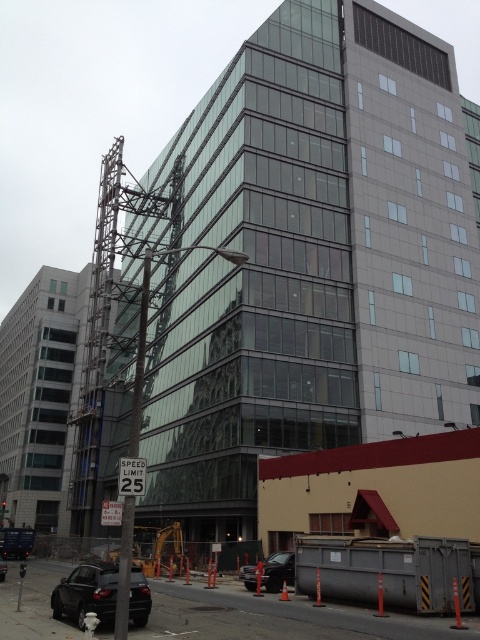
Question: Does gray concrete construction site at lower center appear on the left side of shiny black sedan at lower center?

Choices:
 (A) no
 (B) yes

Answer: (B)

Question: Which object appears farthest from the camera in this image?

Choices:
 (A) gray concrete construction site at lower center
 (B) shiny black sedan at lower center

Answer: (B)

Question: Does gray concrete construction site at lower center have a larger size compared to black matte car at lower left?

Choices:
 (A) yes
 (B) no

Answer: (A)

Question: Which object appears closest to the camera in this image?

Choices:
 (A) black matte car at lower left
 (B) gray concrete construction site at lower center

Answer: (A)

Question: From the image, what is the correct spatial relationship of gray concrete construction site at lower center in relation to shiny black sedan at lower center?

Choices:
 (A) below
 (B) above

Answer: (B)

Question: Which of the following is the closest to the observer?

Choices:
 (A) gray concrete construction site at lower center
 (B) shiny black sedan at lower center
 (C) black matte car at lower left

Answer: (C)